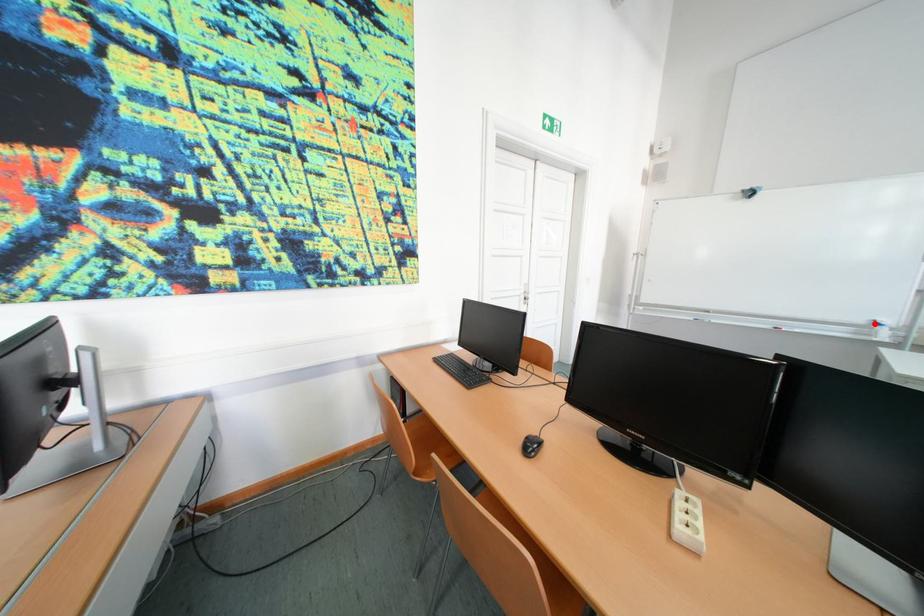
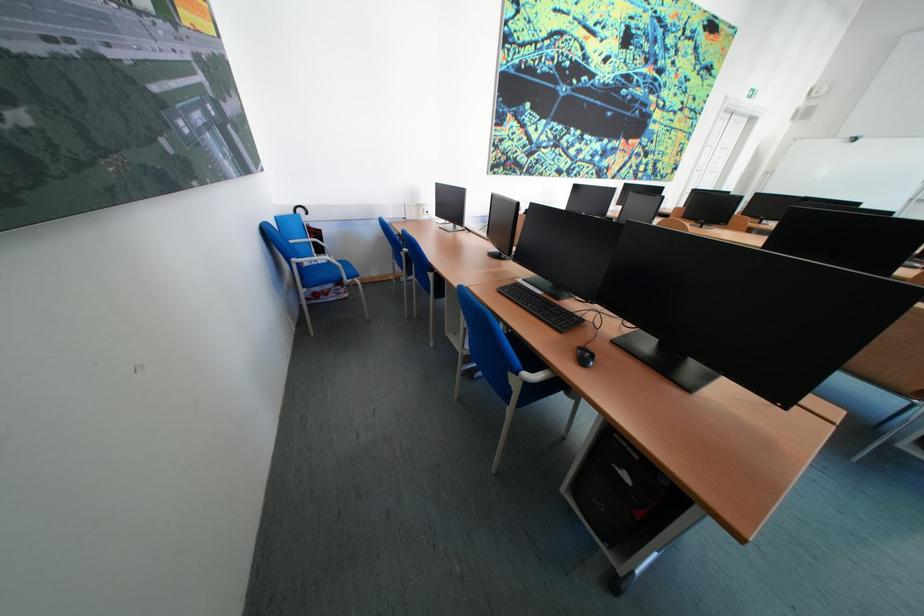
Question: I am providing you with two images of the same scene from different viewpoints. A red point is marked on the first image. Is the red point's position out of view in image 2?

Choices:
 (A) Yes
 (B) No

Answer: (A)